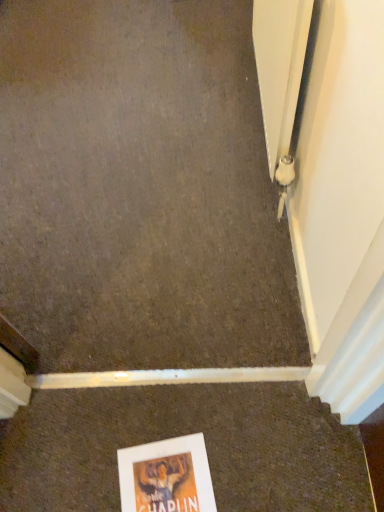
This screenshot has width=384, height=512. Identify the location of white matte picture frame at lower center. (166, 476).

Describe the element at coordinates (166, 476) in the screenshot. I see `white matte picture frame at lower center` at that location.

Find the location of a particular element. white matte picture frame at lower center is located at coordinates (166, 476).